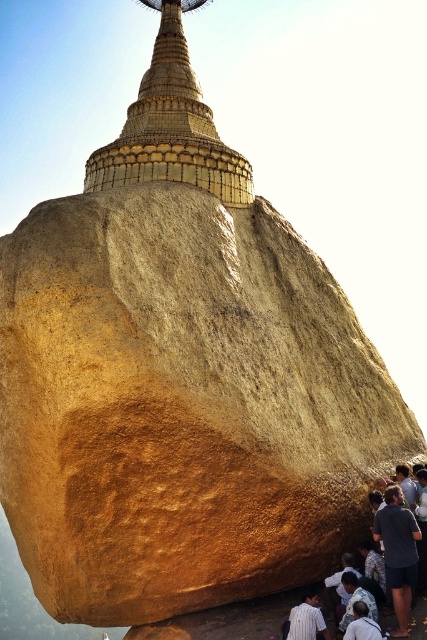
Question: Which object is the farthest from the gold textured stupa at upper center?

Choices:
 (A) white shirt at lower center
 (B) white striped shirt at lower center

Answer: (A)

Question: Which object is positioned farthest from the white striped shirt at lower center?

Choices:
 (A) dark blue shirt at lower right
 (B) gold textured stupa at upper center

Answer: (B)

Question: Does gold textured stupa at upper center appear under white shirt at lower center?

Choices:
 (A) yes
 (B) no

Answer: (B)

Question: Is white striped shirt at lower center below white shirt at lower center?

Choices:
 (A) yes
 (B) no

Answer: (A)

Question: Which of the following is the closest to the observer?

Choices:
 (A) (366, 616)
 (B) (163, 156)
 (C) (411, 579)
 (D) (292, 616)

Answer: (A)

Question: Can you confirm if white striped shirt at lower center is bigger than white shirt at lower center?

Choices:
 (A) yes
 (B) no

Answer: (A)